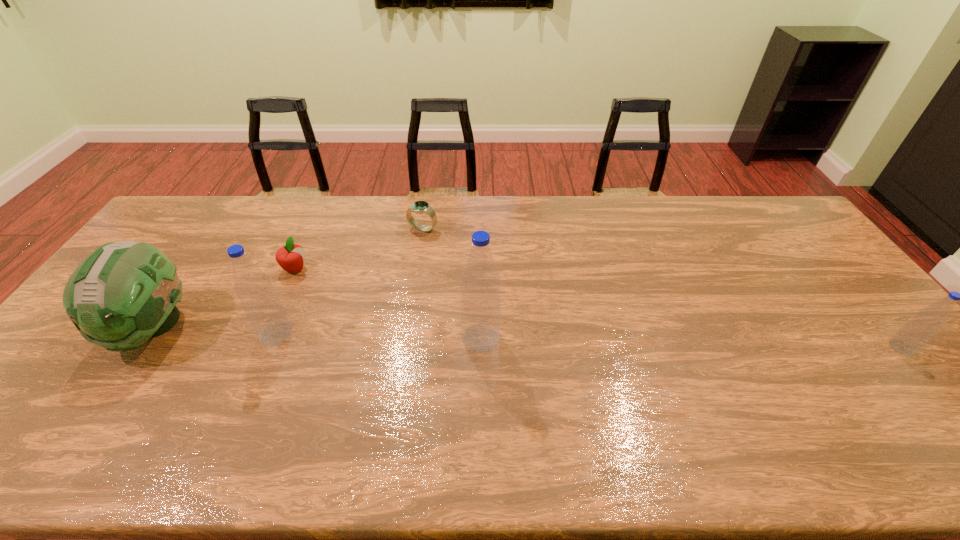
Identify the location of free space located 0.100m on the front of the second tallest object. This screenshot has height=540, width=960. (256, 379).

Locate an element on the screen. This screenshot has height=540, width=960. vacant region located on the back of the second object from right to left is located at coordinates (481, 292).

Locate an element on the screen. vacant area situated on the back of the shortest water bottle is located at coordinates (822, 253).

Image resolution: width=960 pixels, height=540 pixels. What are the coordinates of `free space located on the front of the farthest object` in the screenshot? It's located at (420, 245).

The width and height of the screenshot is (960, 540). Find the location of `free space located on the visor of the football helmet`. free space located on the visor of the football helmet is located at coordinates (108, 392).

Locate an element on the screen. The image size is (960, 540). blank space located 0.050m on the right of the second farthest object is located at coordinates (324, 269).

The height and width of the screenshot is (540, 960). What are the coordinates of `object that is at the far edge` in the screenshot? It's located at (420, 207).

The height and width of the screenshot is (540, 960). Identify the location of object that is at the left edge. point(124,293).

This screenshot has height=540, width=960. I want to click on object situated at the right edge, so click(x=918, y=331).

Locate an element on the screen. free space at the far edge of the desktop is located at coordinates (468, 217).